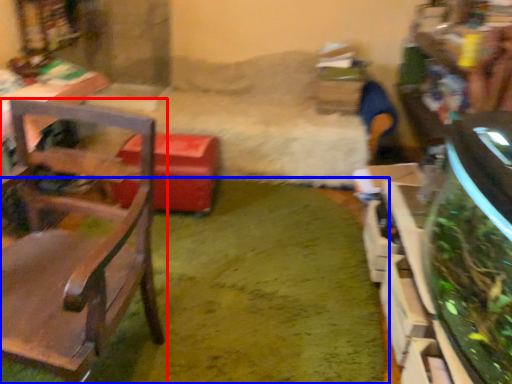
Question: Which of the following is the closest to the observer, chair (highlighted by a red box) or grass (highlighted by a blue box)?

Choices:
 (A) chair
 (B) grass

Answer: (A)